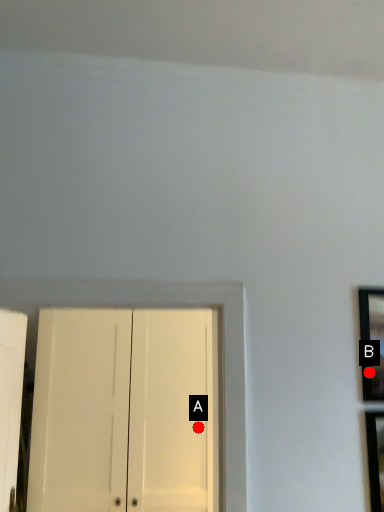
Question: Two points are circled on the image, labeled by A and B beside each circle. Which point appears closest to the camera in this image?

Choices:
 (A) A is closer
 (B) B is closer

Answer: (B)